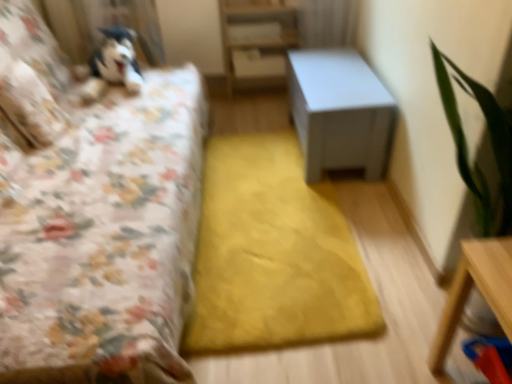
At what (x,y) coordinates should I click in order to perform the action: click on empty space that is ontop of white matte drawer at center (from a real-world perspective). Please return your answer as a coordinate pair (x, y). Looking at the image, I should click on (258, 50).